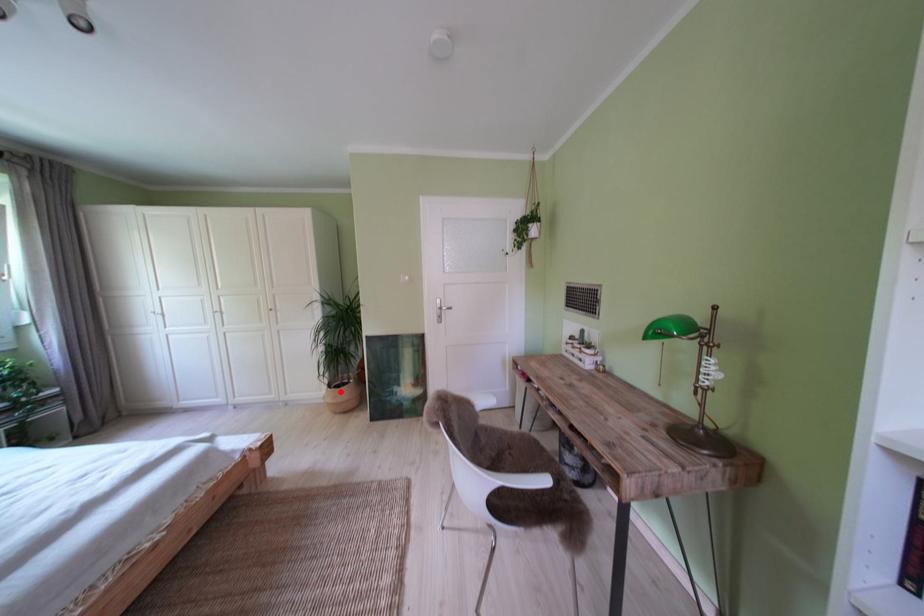
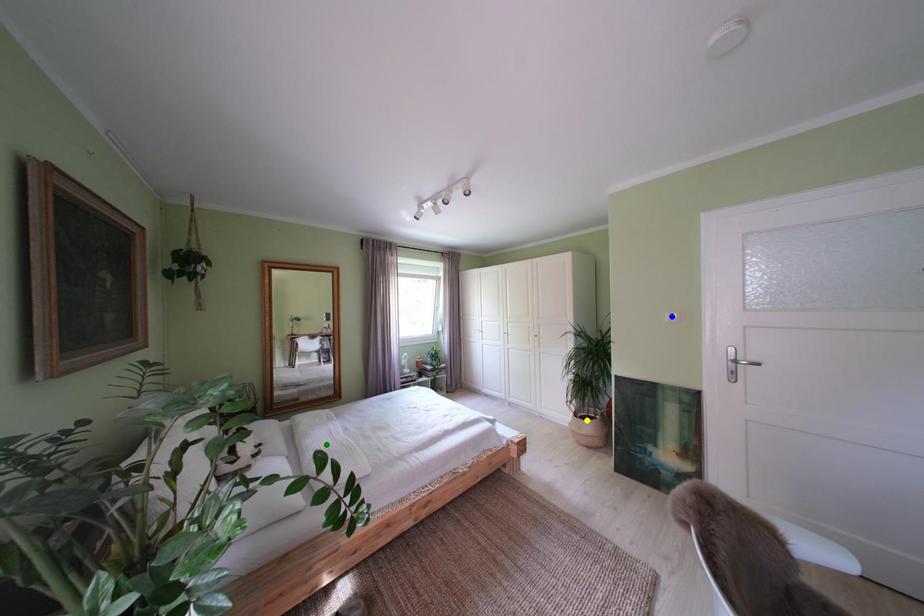
Question: I am providing you with two images of the same scene from different viewpoints. A red point is marked on the first image. You are given multiple points on the second image. Can you choose the point in image 2 that corresponds to the point in image 1?

Choices:
 (A) blue point
 (B) green point
 (C) yellow point

Answer: (C)